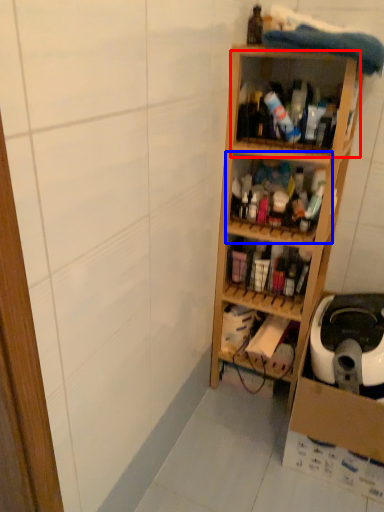
Question: Which object appears farthest to the camera in this image, shelf (highlighted by a red box) or shelf (highlighted by a blue box)?

Choices:
 (A) shelf
 (B) shelf

Answer: (B)